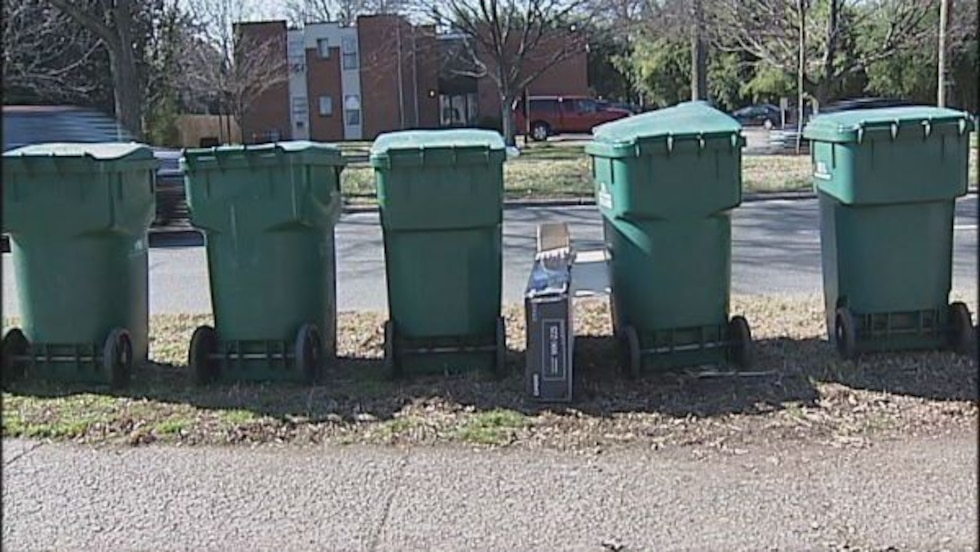
This screenshot has height=552, width=980. I want to click on garbage can lids, so click(x=116, y=151), click(x=298, y=146), click(x=429, y=138), click(x=675, y=123), click(x=859, y=114).